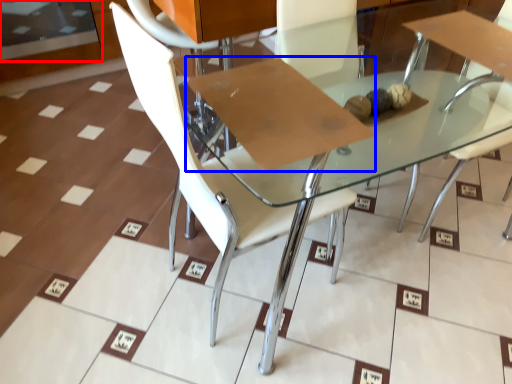
Question: Which of the following is the closest to the observer, glass door (highlighted by a red box) or cardboard (highlighted by a blue box)?

Choices:
 (A) glass door
 (B) cardboard

Answer: (B)